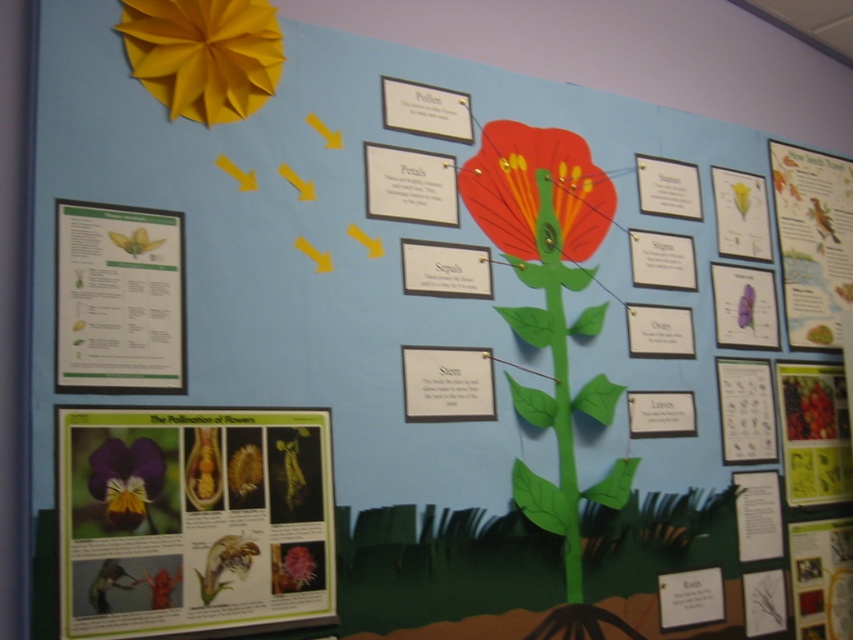
Who is lower down, matte paper flower at center or matte pink flower at lower center?

matte pink flower at lower center

Where is `matte paper flower at center`? matte paper flower at center is located at coordinates (537, 189).

Is green paper poster at lower left taller than matte paper bird at upper right?

No, green paper poster at lower left is not taller than matte paper bird at upper right.

Describe the element at coordinates (119, 300) in the screenshot. The height and width of the screenshot is (640, 853). I see `green paper poster at lower left` at that location.

Identify the location of green paper poster at lower left. Image resolution: width=853 pixels, height=640 pixels. (119, 300).

Locate an element on the screen. This screenshot has height=640, width=853. purple matte flower at lower left is located at coordinates (190, 518).

You are a GUI agent. You are given a task and a screenshot of the screen. Output one action in this format:
    pyautogui.click(x=<x>, y=<y>)
    Task: Click on the purple matte flower at lower left
    The image size is (853, 640).
    Given the screenshot: What is the action you would take?
    pyautogui.click(x=190, y=518)